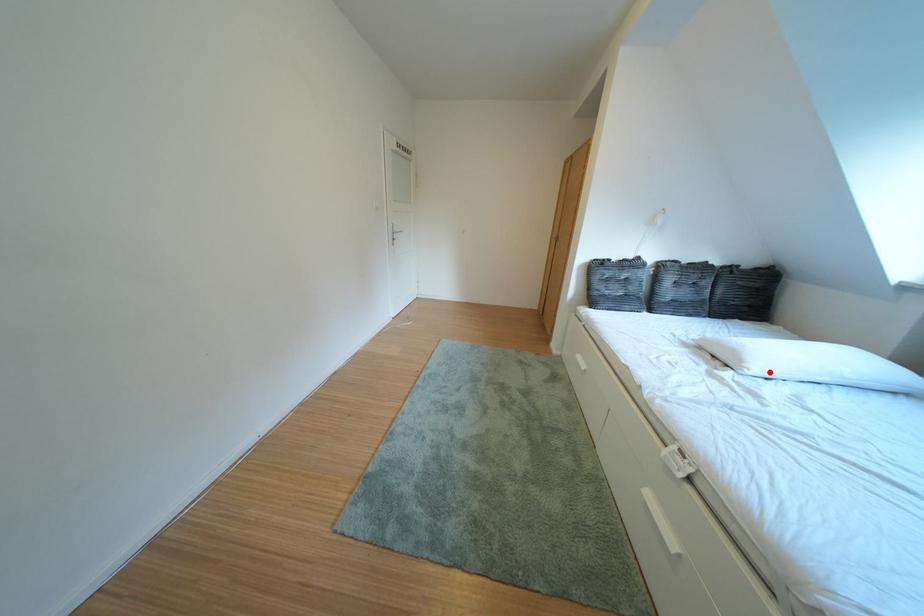
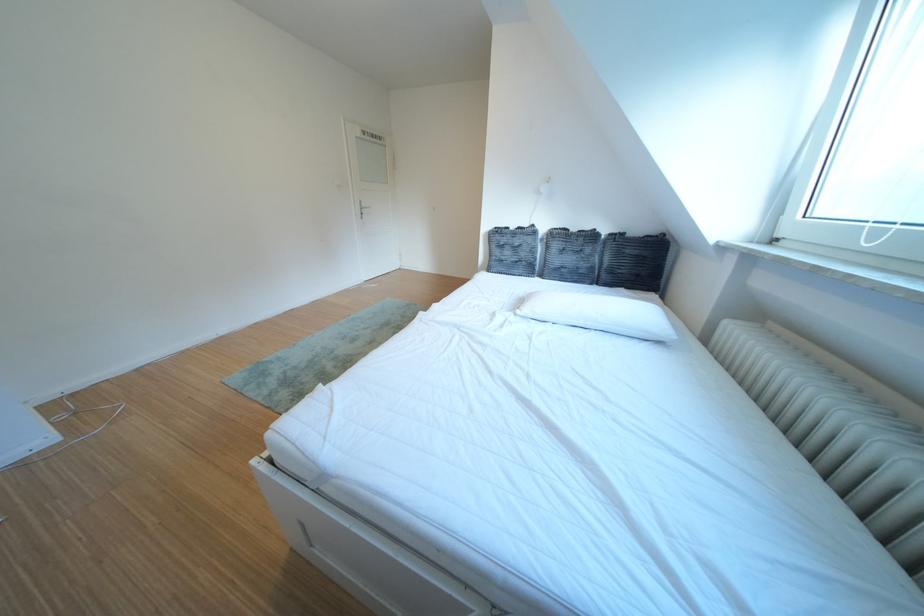
Where in the second image is the point corresponding to the highlighted location from the first image?

(540, 314)